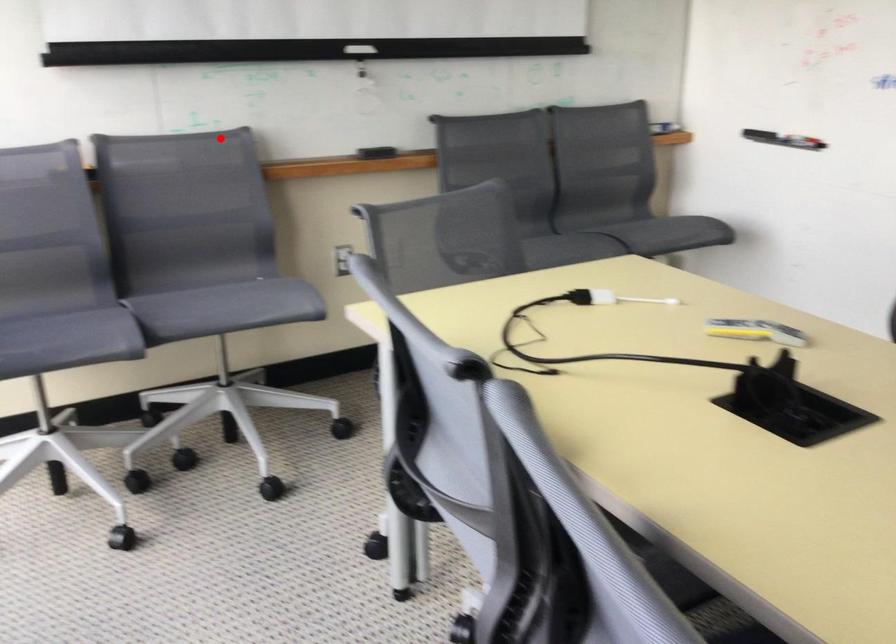
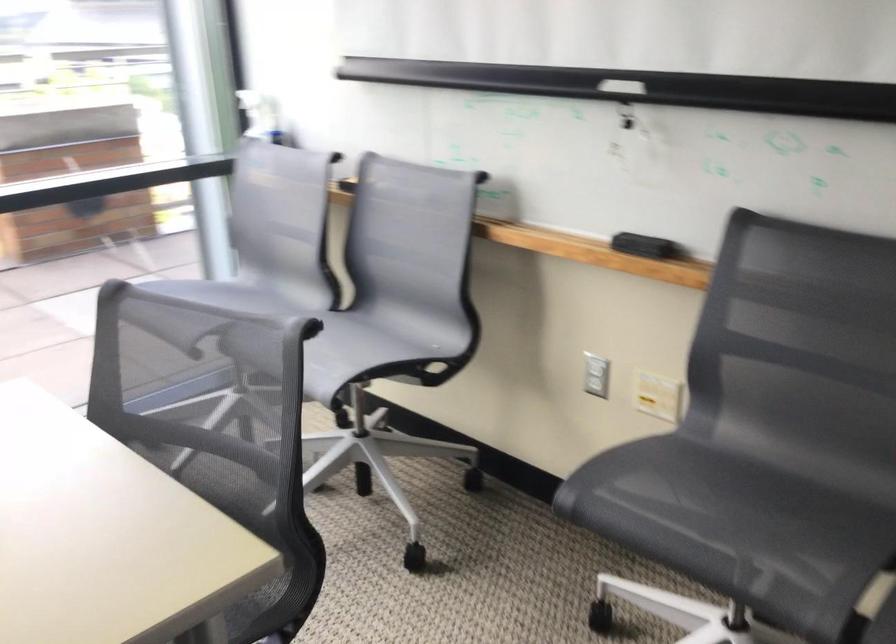
Question: I am providing you with two images of the same scene from different viewpoints. In image1, a red point is highlighted. Considering the same 3D point in image2, which of the following is correct?

Choices:
 (A) It is closer
 (B) It is farther

Answer: (A)